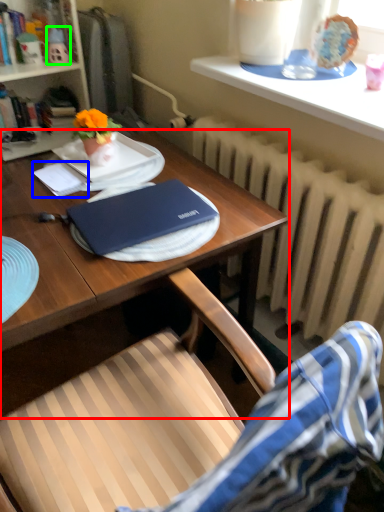
Question: Based on their relative distances, which object is nearer to desk (highlighted by a red box)? Choose from notepad (highlighted by a blue box) and toy (highlighted by a green box).

Choices:
 (A) notepad
 (B) toy

Answer: (A)